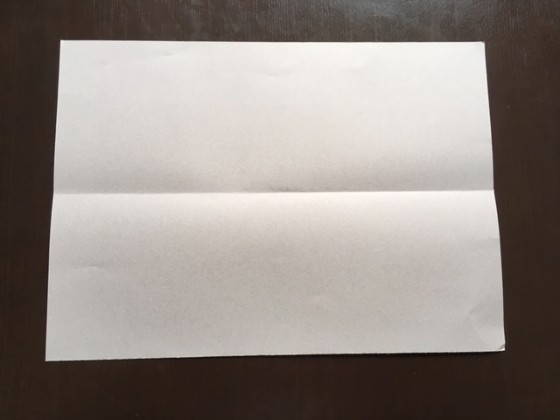
Where is `corners`? The image size is (560, 420). corners is located at coordinates (69, 47), (473, 56), (490, 335), (57, 347).